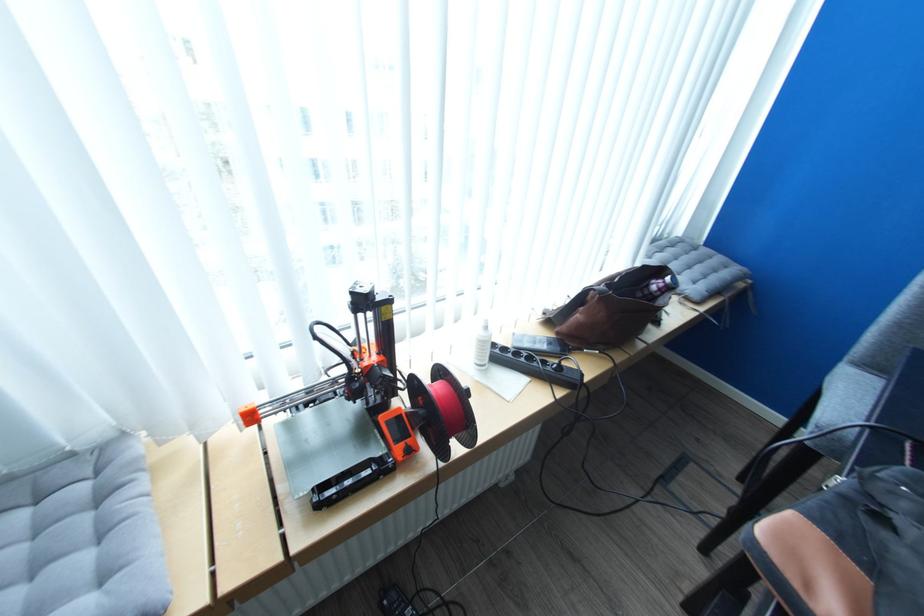
The height and width of the screenshot is (616, 924). In order to click on power strip switch in this screenshot , I will do `click(677, 469)`.